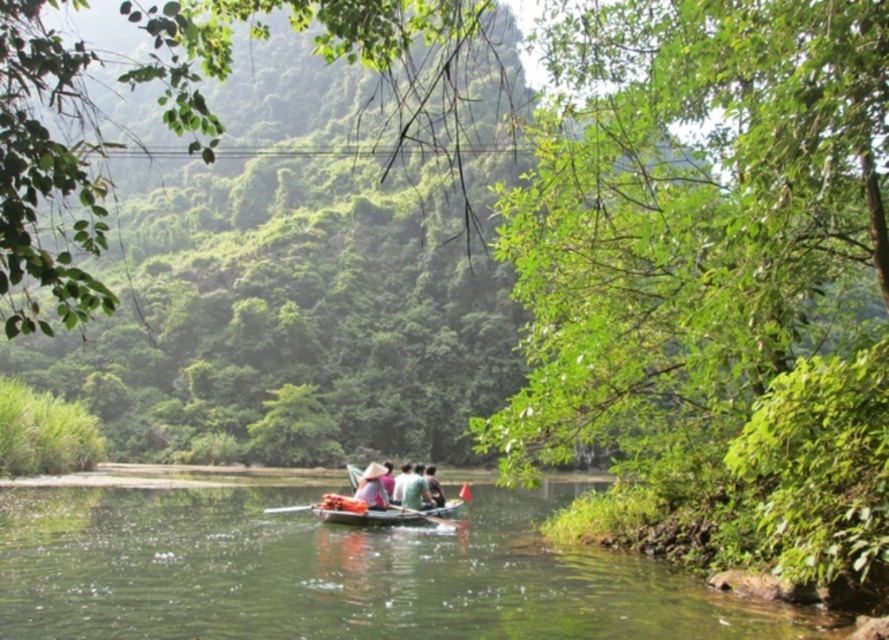
Question: Is wooden canoe at center bigger than green fabric boat at center?

Choices:
 (A) no
 (B) yes

Answer: (A)

Question: Considering the real-world distances, which object is closest to the green fabric shirt at center?

Choices:
 (A) wooden paddle at center
 (B) green smooth water at center
 (C) wooden canoe at center
 (D) white straw hat at center

Answer: (D)

Question: Is green smooth water at center to the right of wooden canoe at center from the viewer's perspective?

Choices:
 (A) yes
 (B) no

Answer: (B)

Question: Does green smooth water at center appear under wooden canoe at center?

Choices:
 (A) no
 (B) yes

Answer: (B)

Question: Which point is farther from the camera taking this photo?

Choices:
 (A) (378, 483)
 (B) (378, 520)
 (C) (423, 481)
 (D) (395, 493)

Answer: (C)

Question: Which of the following is the farthest from the observer?

Choices:
 (A) (415, 509)
 (B) (366, 484)

Answer: (A)